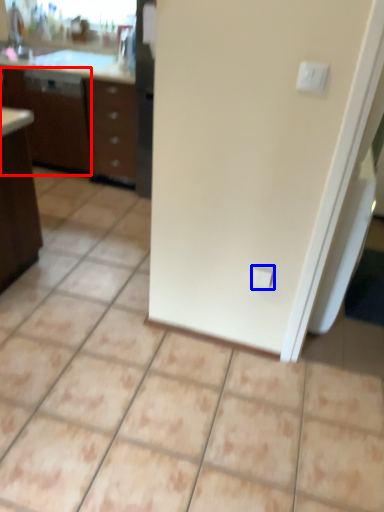
Question: Among these objects, which one is nearest to the camera, file cabinet (highlighted by a red box) or electric outlet (highlighted by a blue box)?

Choices:
 (A) file cabinet
 (B) electric outlet

Answer: (B)